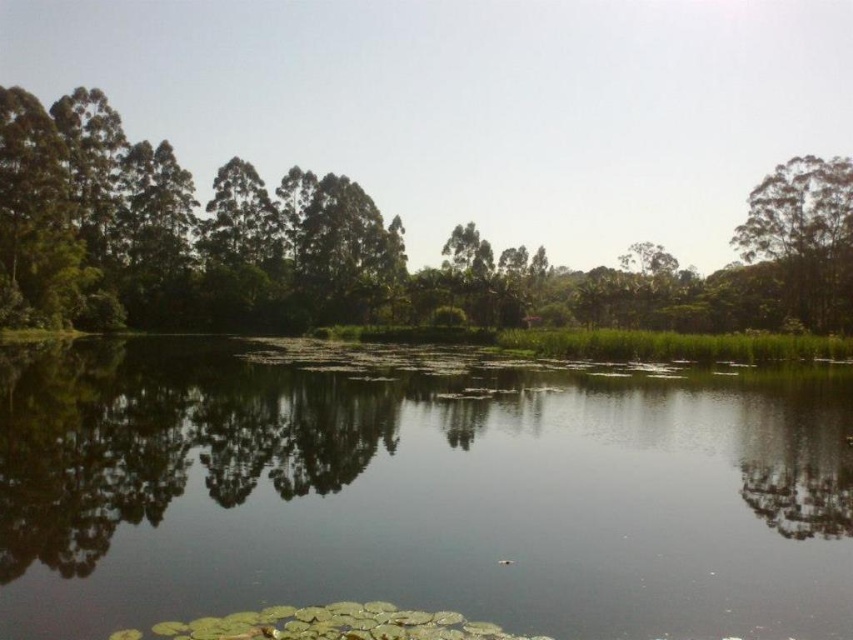
Question: Is green leafy water at center thinner than green leafy tree at upper right?

Choices:
 (A) no
 (B) yes

Answer: (A)

Question: Which point is farther from the camera taking this photo?

Choices:
 (A) (833, 280)
 (B) (78, 307)

Answer: (A)

Question: Can you confirm if green leafy water at center is positioned below green leafy trees at center?

Choices:
 (A) no
 (B) yes

Answer: (B)

Question: Where is green leafy water at center located in relation to green leafy trees at center in the image?

Choices:
 (A) right
 (B) left

Answer: (B)

Question: Which point is farther to the camera?

Choices:
 (A) 158,252
 (B) 801,298

Answer: (A)

Question: Among these points, which one is nearest to the camera?

Choices:
 (A) (834, 625)
 (B) (848, 193)
 (C) (844, 246)

Answer: (A)